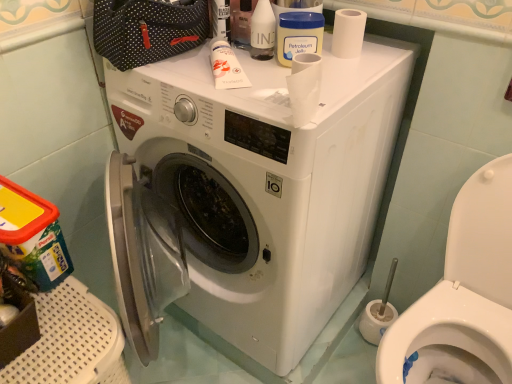
The width and height of the screenshot is (512, 384). Identify the location of free space in front of white matte toilet paper at upper right. (348, 74).